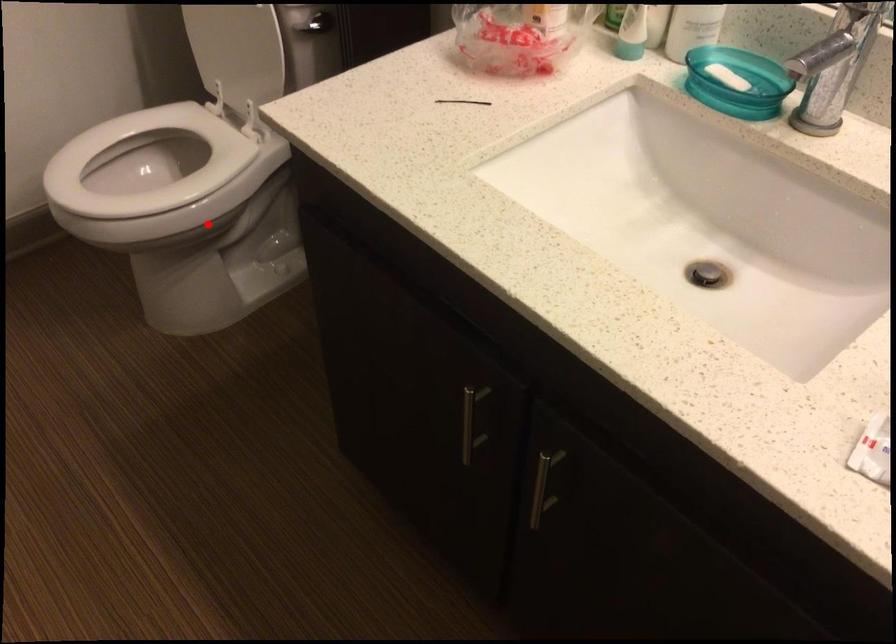
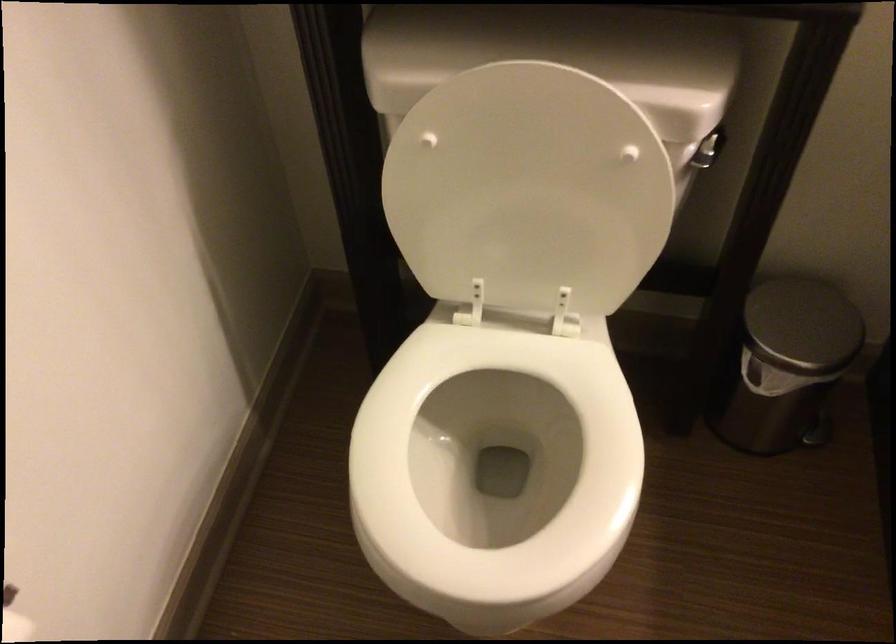
Find the pixel in the second image that matches the highlighted location in the first image.

(494, 468)